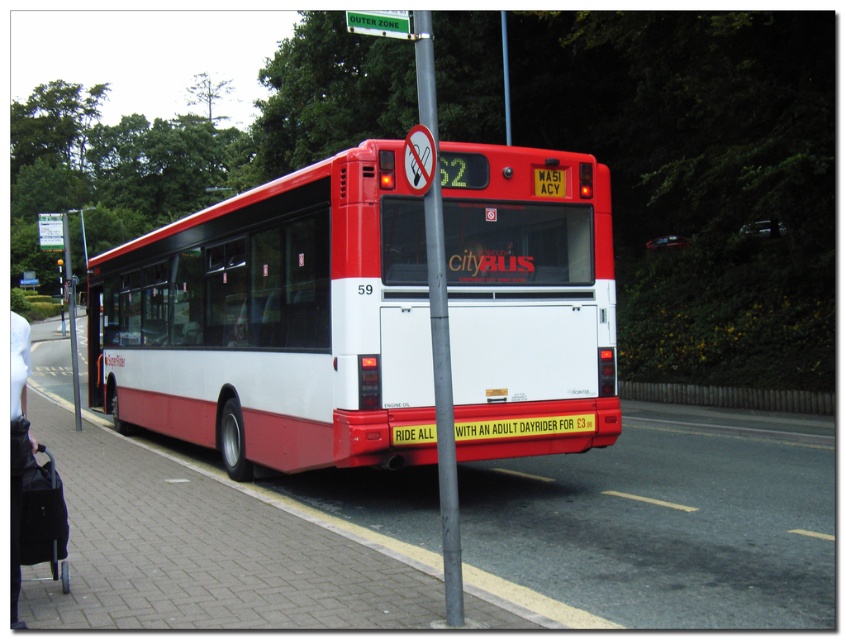
Is red matte bus at center wider than metallic gray pole at center?

Yes, red matte bus at center is wider than metallic gray pole at center.

Describe the element at coordinates (273, 321) in the screenshot. The image size is (846, 640). I see `red matte bus at center` at that location.

Where is `red matte bus at center`? This screenshot has height=640, width=846. red matte bus at center is located at coordinates (273, 321).

Which is in front, point (427, 195) or point (367, 12)?

Point (367, 12) is in front.

Can you confirm if metallic gray pole at center is bigger than green plastic sign at upper center?

Indeed, metallic gray pole at center has a larger size compared to green plastic sign at upper center.

Who is more forward, (x=432, y=320) or (x=365, y=20)?

Point (x=365, y=20)

This screenshot has width=846, height=640. What are the coordinates of `metallic gray pole at center` in the screenshot? It's located at (438, 330).

Is metallic gray pole at center shorter than yellowtexturedlicense plate at center?

No, metallic gray pole at center is not shorter than yellowtexturedlicense plate at center.

Between metallic gray pole at center and yellowtexturedlicense plate at center, which one appears on the left side from the viewer's perspective?

Positioned to the left is metallic gray pole at center.

Is point (438, 179) behind point (493, 419)?

No.

Locate an element on the screen. metallic gray pole at center is located at coordinates coord(438,330).